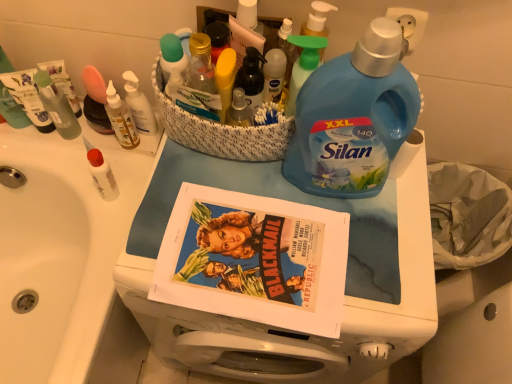
Locate an element on the screen. This screenshot has height=384, width=512. matte paper comic book at center is located at coordinates (254, 260).

Measure the distance between white plastic bottle at upper left, the third toiletry positioned from the left, and camera.

34.61 inches.

Describe the element at coordinates (353, 118) in the screenshot. The height and width of the screenshot is (384, 512). I see `blue plastic bottle at upper right, placed as the first bottle when sorted from right to left` at that location.

Identify the location of translucent plastic bottles at upper left, which is the 2th toiletry from left to right. (121, 119).

The image size is (512, 384). Describe the element at coordinates (345, 286) in the screenshot. I see `blue plastic laundry detergent at center` at that location.

In order to face blue plastic laundry detergent at center, should I rotate leftwards or rightwards?

You should rotate right by 2.038 degrees.

Find the location of a particular element. The image size is (512, 384). matte paper comic book at center is located at coordinates (254, 260).

Between translucent plastic bottle at upper center, placed as the first toiletry when sorted from right to left, and white matte bottle at left, the first toiletry viewed from the left, which one is positioned behind?

white matte bottle at left, the first toiletry viewed from the left, is more distant.

Based on their sizes in the image, would you say translucent plastic bottle at upper center, placed as the first toiletry when sorted from right to left, is bigger or smaller than white matte bottle at left, the first toiletry viewed from the left?

Considering their sizes, translucent plastic bottle at upper center, placed as the first toiletry when sorted from right to left, takes up less space than white matte bottle at left, the first toiletry viewed from the left.

From the picture: Which object is positioned more to the left, translucent plastic bottle at upper center, the 4th toiletry viewed from the left, or white matte bottle at left, the 4th toiletry viewed from the right?

Positioned to the left is white matte bottle at left, the 4th toiletry viewed from the right.

From a real-world perspective, between translucent plastic bottles at upper left, which is counted as the 3th toiletry, starting from the right, and white glossy sink at upper left, who is vertically higher?

translucent plastic bottles at upper left, which is counted as the 3th toiletry, starting from the right.

From the image's perspective, is translucent plastic bottles at upper left, which is counted as the 3th toiletry, starting from the right, above or below white glossy sink at upper left?

Based on their image positions, translucent plastic bottles at upper left, which is counted as the 3th toiletry, starting from the right, is located above white glossy sink at upper left.

At what (x,y) coordinates should I click in order to perform the action: click on sink on the left of translucent plastic bottles at upper left, which is the 2th toiletry from left to right. Please return your answer as a coordinate pair (x, y). Looking at the image, I should click on (60, 251).

Considering the positions of point (114, 104) and point (49, 134), is point (114, 104) closer or farther from the camera than point (49, 134)?

Point (114, 104) appears to be closer to the viewer than point (49, 134).

Image resolution: width=512 pixels, height=384 pixels. In order to click on sink located below the white plastic bottle at upper left, which ranks as the second toiletry in right-to-left order (from the image's perspective) in this screenshot , I will do `click(60, 251)`.

Is white plastic bottle at upper left, the third toiletry positioned from the left, not within white glossy sink at upper left?

Yes, white plastic bottle at upper left, the third toiletry positioned from the left, is located beyond the bounds of white glossy sink at upper left.

What's the angular difference between white plastic bottle at upper left, the third toiletry positioned from the left, and white glossy sink at upper left's facing directions?

The facing directions of white plastic bottle at upper left, the third toiletry positioned from the left, and white glossy sink at upper left are 90.7 degrees apart.

Is blue plastic laundry detergent at center inside the boundaries of translucent plastic bottle at upper center, the 4th toiletry viewed from the left, or outside?

blue plastic laundry detergent at center is outside translucent plastic bottle at upper center, the 4th toiletry viewed from the left.

From a real-world perspective, which object stands above the other?

translucent plastic bottle at upper center, placed as the first toiletry when sorted from right to left.

Considering the relative positions of blue plastic laundry detergent at center and translucent plastic bottle at upper center, the 4th toiletry viewed from the left, in the image provided, is blue plastic laundry detergent at center behind translucent plastic bottle at upper center, the 4th toiletry viewed from the left,?

No, blue plastic laundry detergent at center is closer to the viewer.

From the image's perspective, between blue plastic laundry detergent at center and translucent plastic bottle at upper center, placed as the first toiletry when sorted from right to left, who is located below?

From the image's view, blue plastic laundry detergent at center is below.

Can you confirm if translucent plastic bottle at upper center, placed as the first toiletry when sorted from right to left, is smaller than green plastic spray bottle at upper center?

Yes, translucent plastic bottle at upper center, placed as the first toiletry when sorted from right to left, is smaller than green plastic spray bottle at upper center.

Relative to green plastic spray bottle at upper center, is translucent plastic bottle at upper center, placed as the first toiletry when sorted from right to left, in front or behind?

Visually, translucent plastic bottle at upper center, placed as the first toiletry when sorted from right to left, is located behind green plastic spray bottle at upper center.

Where is `toiletry that is above the green plastic spray bottle at upper center (from the image's perspective)`? toiletry that is above the green plastic spray bottle at upper center (from the image's perspective) is located at coordinates (203, 71).

Is translucent plastic bottle at upper center, placed as the first toiletry when sorted from right to left, completely or partially outside of green plastic spray bottle at upper center?

translucent plastic bottle at upper center, placed as the first toiletry when sorted from right to left, lies outside green plastic spray bottle at upper center's area.

From the image's perspective, is blue plastic bottle at upper right, placed as the first bottle when sorted from right to left, located beneath blue plastic laundry detergent at center?

Actually, blue plastic bottle at upper right, placed as the first bottle when sorted from right to left, appears above blue plastic laundry detergent at center in the image.

Can you tell me how much blue plastic bottle at upper right, placed as the first bottle when sorted from right to left, and blue plastic laundry detergent at center differ in facing direction?

blue plastic bottle at upper right, placed as the first bottle when sorted from right to left, and blue plastic laundry detergent at center are facing 1.35 degrees away from each other.

Is blue plastic bottle at upper right, placed as the first bottle when sorted from right to left, far from blue plastic laundry detergent at center?

blue plastic bottle at upper right, placed as the first bottle when sorted from right to left, is near blue plastic laundry detergent at center, not far away.

Is blue plastic bottle at upper right, placed as the second bottle when sorted from left to right, positioned behind blue plastic laundry detergent at center?

That is False.

Are translucent plastic bottle at upper center, placed as the first toiletry when sorted from right to left, and blue plastic bottle at upper right, placed as the second bottle when sorted from left to right, located far from each other?

No, there isn't a large distance between translucent plastic bottle at upper center, placed as the first toiletry when sorted from right to left, and blue plastic bottle at upper right, placed as the second bottle when sorted from left to right.

From the image's perspective, relative to blue plastic bottle at upper right, placed as the second bottle when sorted from left to right, is translucent plastic bottle at upper center, the 4th toiletry viewed from the left, above or below?

translucent plastic bottle at upper center, the 4th toiletry viewed from the left, is situated higher than blue plastic bottle at upper right, placed as the second bottle when sorted from left to right, in the image.

Which object is positioned more to the right, translucent plastic bottle at upper center, placed as the first toiletry when sorted from right to left, or blue plastic bottle at upper right, placed as the first bottle when sorted from right to left?

Positioned to the right is blue plastic bottle at upper right, placed as the first bottle when sorted from right to left.

Is translucent plastic bottle at upper center, the 4th toiletry viewed from the left, in front of blue plastic bottle at upper right, placed as the first bottle when sorted from right to left?

No.

At what (x,y) coordinates should I click in order to perform the action: click on the 3rd toiletry directly above the white matte bottle at left, the first toiletry viewed from the left (from a real-world perspective). Please return your answer as a coordinate pair (x, y). Looking at the image, I should click on (203, 71).

At what (x,y) coordinates should I click in order to perform the action: click on toiletry that is the 2nd one when counting rightward from the white glossy sink at upper left. Please return your answer as a coordinate pair (x, y). The width and height of the screenshot is (512, 384). Looking at the image, I should click on (121, 119).

Based on their spatial positions, is translucent plastic bottles at upper left, which is counted as the 3th toiletry, starting from the right, or matte paper comic book at center closer to white matte bottle at left, the 4th toiletry viewed from the right?

translucent plastic bottles at upper left, which is counted as the 3th toiletry, starting from the right.

Which object lies further to the anchor point white matte bottle at left, the first toiletry viewed from the left, translucent plastic bottles at upper left, which is the 2th toiletry from left to right, or white plastic bottle at upper left, the third toiletry positioned from the left?

Based on the image, white plastic bottle at upper left, the third toiletry positioned from the left, appears to be further to white matte bottle at left, the first toiletry viewed from the left.

Considering their positions, is green plastic spray bottle at upper center positioned further to matte paper comic book at center than white plastic bottle at upper left, the third toiletry positioned from the left?

white plastic bottle at upper left, the third toiletry positioned from the left.

Estimate the real-world distances between objects in this image. Which object is further from matte paper comic book at center, translucent plastic bottle at upper center, the 4th toiletry viewed from the left, or translucent plastic bottle at center, which appears as the first bottle when viewed from the left?

Among the two, translucent plastic bottle at center, which appears as the first bottle when viewed from the left, is located further to matte paper comic book at center.

Looking at the image, which one is located closer to green plastic spray bottle at upper center, white matte bottle at left, the 4th toiletry viewed from the right, or translucent plastic bottles at upper left, which is counted as the 3th toiletry, starting from the right?

The object closer to green plastic spray bottle at upper center is translucent plastic bottles at upper left, which is counted as the 3th toiletry, starting from the right.

In the scene shown: When comparing their distances from translucent plastic bottle at upper center, placed as the first toiletry when sorted from right to left, does white matte bottle at left, the first toiletry viewed from the left, or white plastic bottle at upper left, the third toiletry positioned from the left, seem closer?

Among the two, white plastic bottle at upper left, the third toiletry positioned from the left, is located nearer to translucent plastic bottle at upper center, placed as the first toiletry when sorted from right to left.

Based on their spatial positions, is green plastic spray bottle at upper center or translucent plastic bottles at upper left, which is the 2th toiletry from left to right, closer to matte paper comic book at center?

green plastic spray bottle at upper center lies closer to matte paper comic book at center than the other object.

Estimate the real-world distances between objects in this image. Which object is closer to matte paper comic book at center, translucent plastic bottle at center, which appears as the first bottle when viewed from the left, or green plastic spray bottle at upper center?

green plastic spray bottle at upper center is closer to matte paper comic book at center.

Image resolution: width=512 pixels, height=384 pixels. Find the location of `bottle between white glossy sink at upper left and green plastic spray bottle at upper center in the horizontal direction`. bottle between white glossy sink at upper left and green plastic spray bottle at upper center in the horizontal direction is located at coordinates (251, 77).

The height and width of the screenshot is (384, 512). Find the location of `bottle between white matte bottle at left, the 4th toiletry viewed from the right, and blue plastic bottle at upper right, placed as the second bottle when sorted from left to right, in the horizontal direction`. bottle between white matte bottle at left, the 4th toiletry viewed from the right, and blue plastic bottle at upper right, placed as the second bottle when sorted from left to right, in the horizontal direction is located at coordinates (251, 77).

The image size is (512, 384). I want to click on comic book between white glossy sink at upper left and green plastic spray bottle at upper center, so [254, 260].

Find the location of a particular element. Image resolution: width=512 pixels, height=384 pixels. comic book between blue plastic bottle at upper right, placed as the second bottle when sorted from left to right, and blue plastic laundry detergent at center from top to bottom is located at coordinates (254, 260).